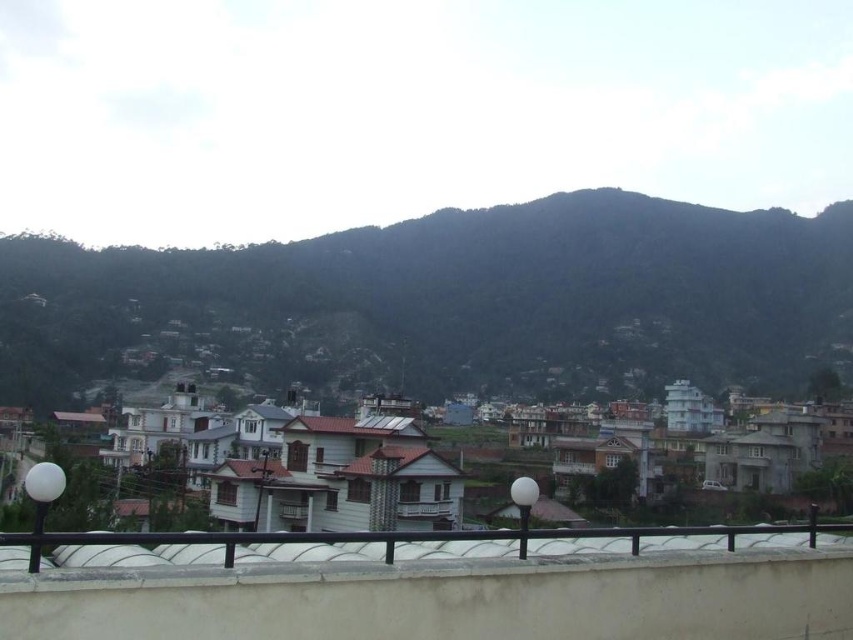
You are standing at the point with coordinates point [283,500] and want to walk to the point with coordinates point [622,192]. Will the path between them be obstructed by any of the buildings in the scene?

Point [622,192] is behind point [283,500], so the path between them may be obstructed by the buildings located in the middle ground between these two points.

You are standing on the rooftop and looking at the white painted wooden houses at center and the white matte rail at lower center. Which object is taller?

The white painted wooden houses at center is much taller than the white matte rail at lower center.